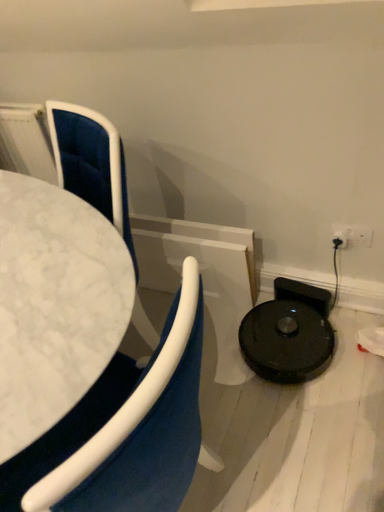
Question: Considering the relative positions of velvet blue chair at left, positioned as the first chair in right-to-left order, and velvet blue chair at left, positioned as the first chair in left-to-right order, in the image provided, is velvet blue chair at left, positioned as the first chair in right-to-left order, to the left or to the right of velvet blue chair at left, positioned as the first chair in left-to-right order,?

Choices:
 (A) right
 (B) left

Answer: (A)

Question: Considering the positions of velvet blue chair at left, which ranks as the 2th chair in left-to-right order, and velvet blue chair at left, positioned as the first chair in left-to-right order, in the image, is velvet blue chair at left, which ranks as the 2th chair in left-to-right order, wider or thinner than velvet blue chair at left, positioned as the first chair in left-to-right order,?

Choices:
 (A) wide
 (B) thin

Answer: (B)

Question: Is velvet blue chair at left, which ranks as the 2th chair in left-to-right order, inside or outside of velvet blue chair at left, positioned as the first chair in left-to-right order?

Choices:
 (A) inside
 (B) outside

Answer: (A)

Question: In the image, is velvet blue chair at left, acting as the 2th chair starting from the right, on the left side or the right side of velvet blue chair at left, positioned as the first chair in right-to-left order?

Choices:
 (A) left
 (B) right

Answer: (A)

Question: From the image's perspective, is velvet blue chair at left, positioned as the first chair in left-to-right order, located above or below velvet blue chair at left, which ranks as the 2th chair in left-to-right order?

Choices:
 (A) below
 (B) above

Answer: (A)

Question: Is point (120, 446) closer or farther from the camera than point (110, 205)?

Choices:
 (A) closer
 (B) farther

Answer: (A)

Question: From a real-world perspective, is velvet blue chair at left, acting as the 2th chair starting from the right, above or below velvet blue chair at left, positioned as the first chair in right-to-left order?

Choices:
 (A) above
 (B) below

Answer: (B)